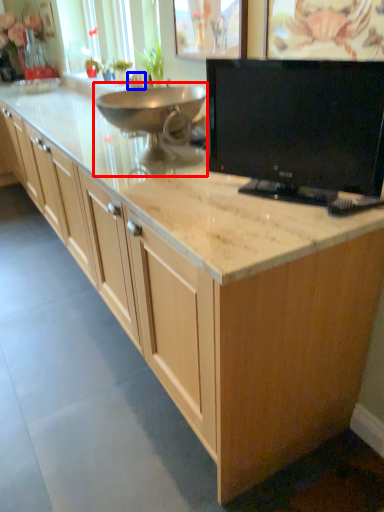
Question: Which of the following is the farthest to the observer, appliance (highlighted by a red box) or faucet (highlighted by a blue box)?

Choices:
 (A) appliance
 (B) faucet

Answer: (B)